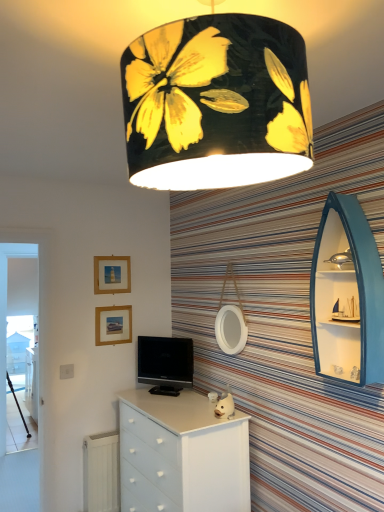
Identify the location of free space behind transparent glass screen door at left. (30, 442).